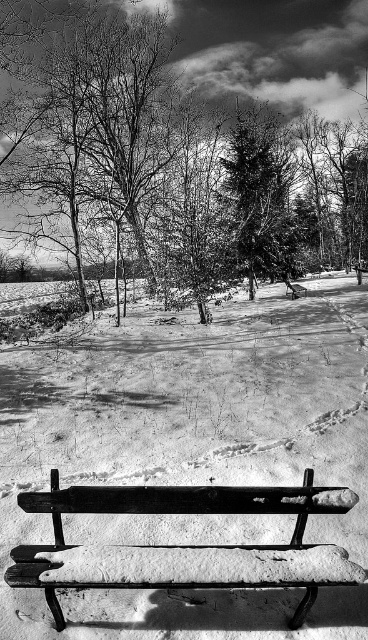
You are standing at the wooden bench in the winter scene. You see two points marked on the snow. Which point is closer to you, point (x=242, y=570) or point (x=235, y=70)?

Point (x=242, y=570) is in front of point (x=235, y=70), so it is closer to you.

You are standing in the winter scene and want to walk towards the two points marked in the image. Which point, point (27, 499) or point (242, 198), will you reach first?

You will reach point (27, 499) first because it is closer to you than point (242, 198).

You are standing at the edge of the snowy area and want to sit on the wooden bench at lower center. Which direction should you walk to reach it without passing under the smooth bark tree at center?

The wooden bench at lower center is located below the smooth bark tree at center, so you should walk towards the bench directly since it is already positioned under the tree. Alternatively, if you want to avoid passing under the tree, you might need to approach from the side where the bench is located, as it is directly beneath the tree.